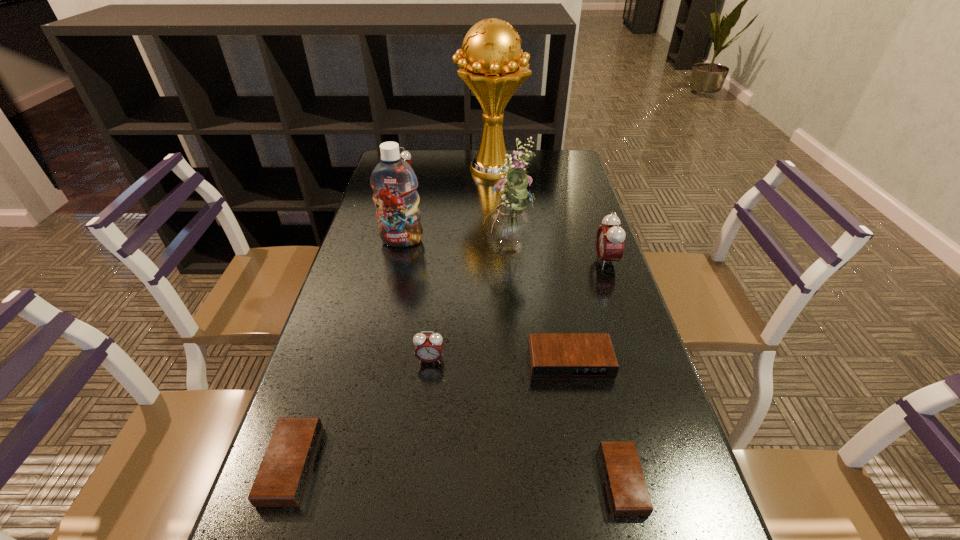
Find the location of a particular element. The image size is (960, 540). the nearest pink alarm clock is located at coordinates (428, 348).

Find the location of `the biggest black alarm clock`. the biggest black alarm clock is located at coordinates (551, 355).

This screenshot has height=540, width=960. What are the coordinates of `the third shortest alarm clock` in the screenshot? It's located at (551, 355).

Where is `the leftmost black alarm clock`? the leftmost black alarm clock is located at coordinates (282, 477).

Identify the location of the fifth tallest alarm clock. This screenshot has width=960, height=540. (282, 477).

Identify the location of the smallest black alarm clock. The width and height of the screenshot is (960, 540). (628, 494).

This screenshot has width=960, height=540. Identify the location of the shortest object. (628, 494).

Find the location of `vacant area situated at the front of the trophy_cup where the globe is prominent`. vacant area situated at the front of the trophy_cup where the globe is prominent is located at coordinates (427, 169).

I want to click on free space located at the front of the trophy_cup where the globe is prominent, so click(421, 169).

At what (x,y) coordinates should I click in order to perform the action: click on vacant space located at the front of the trophy_cup where the globe is prominent. Please return your answer as a coordinate pair (x, y). This screenshot has height=540, width=960. Looking at the image, I should click on (427, 169).